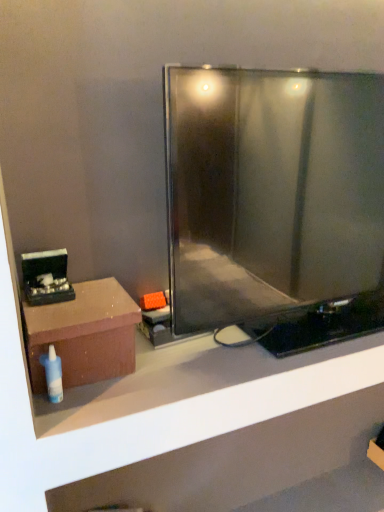
This screenshot has height=512, width=384. I want to click on vacant space to the right of black glossy jewelry box at left, so click(x=97, y=306).